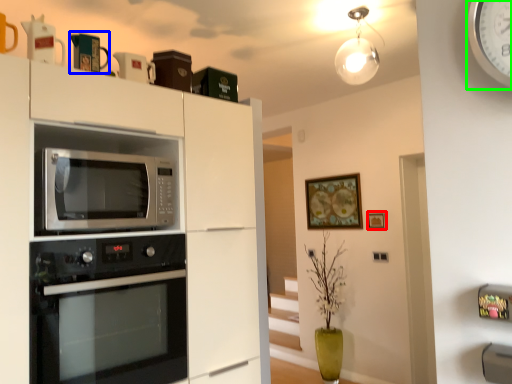
Question: Based on their relative distances, which object is farther from picture frame (highlighted by a red box)? Choose from appliance (highlighted by a blue box) and clock (highlighted by a green box).

Choices:
 (A) appliance
 (B) clock

Answer: (B)